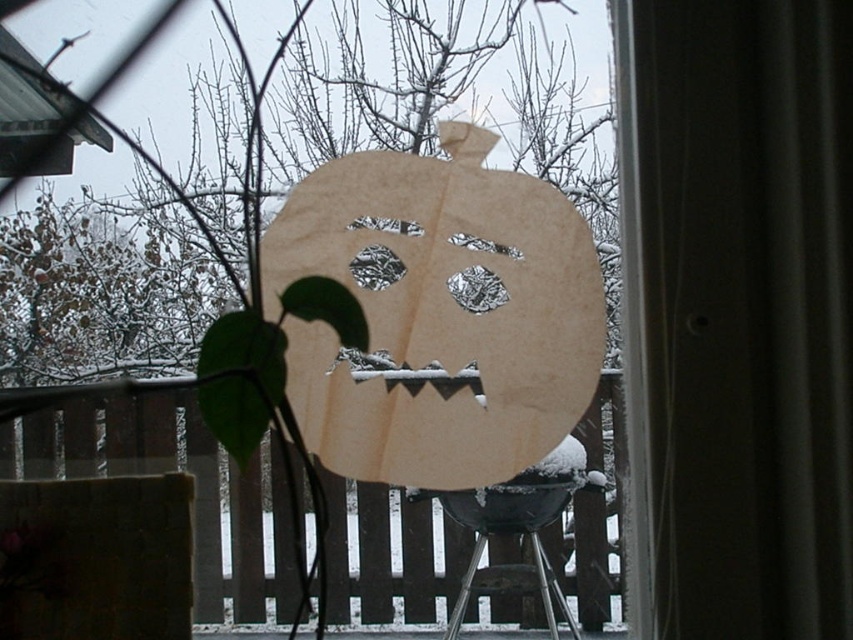
Question: Can you confirm if transparent plastic screen door at center is positioned to the right of metallic stool at lower center?

Choices:
 (A) no
 (B) yes

Answer: (B)

Question: Can you confirm if transparent plastic screen door at center is wider than metallic stool at lower center?

Choices:
 (A) yes
 (B) no

Answer: (A)

Question: Does transparent plastic screen door at center appear on the right side of metallic stool at lower center?

Choices:
 (A) no
 (B) yes

Answer: (B)

Question: Which of the following is the closest to the observer?

Choices:
 (A) (693, 470)
 (B) (514, 568)

Answer: (A)

Question: Which point is farther to the camera?

Choices:
 (A) (550, 609)
 (B) (692, 353)

Answer: (A)